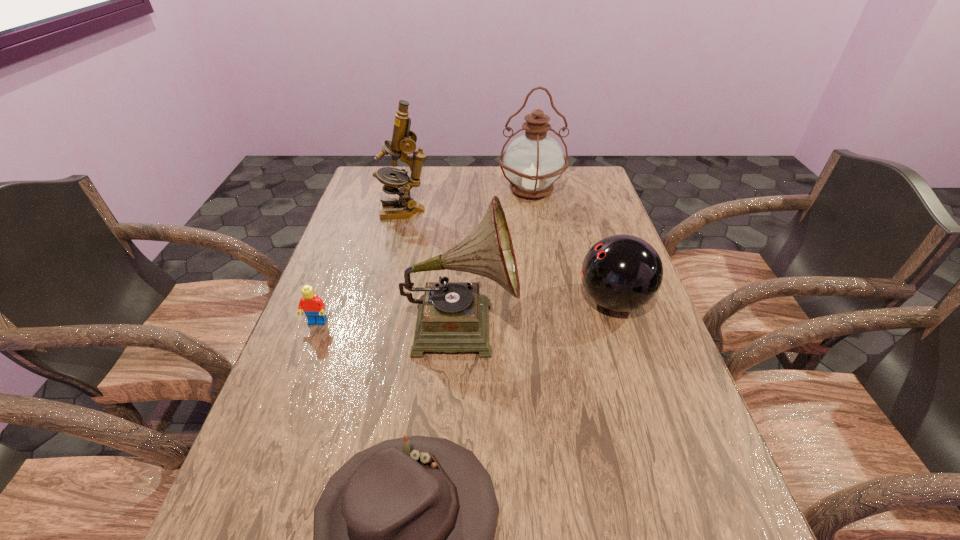
I want to click on oil lamp, so click(534, 161).

Identify the location of microscope. The height and width of the screenshot is (540, 960). (404, 140).

Where is `record player`? The image size is (960, 540). record player is located at coordinates (453, 317).

Find the location of a particular element. This screenshot has width=960, height=540. bowling ball is located at coordinates (x=621, y=273).

At what (x,y) coordinates should I click in order to perform the action: click on the leftmost object. Please return your answer as a coordinate pair (x, y). Image resolution: width=960 pixels, height=540 pixels. Looking at the image, I should click on (313, 306).

Find the location of a particular element. blank area located 0.070m on the left of the oil lamp is located at coordinates (478, 190).

At what (x,y) coordinates should I click in order to perform the action: click on vacant space located on the front of the microscope. Please return your answer as a coordinate pair (x, y). The width and height of the screenshot is (960, 540). Looking at the image, I should click on (390, 273).

The image size is (960, 540). I want to click on vacant space located 0.110m from the horn of the record player, so click(563, 325).

Where is `free space located 0.080m on the surface of the fourth tallest object near the finger holes`? Image resolution: width=960 pixels, height=540 pixels. free space located 0.080m on the surface of the fourth tallest object near the finger holes is located at coordinates (545, 301).

The height and width of the screenshot is (540, 960). I want to click on vacant area situated on the surface of the fourth tallest object near the finger holes, so click(448, 301).